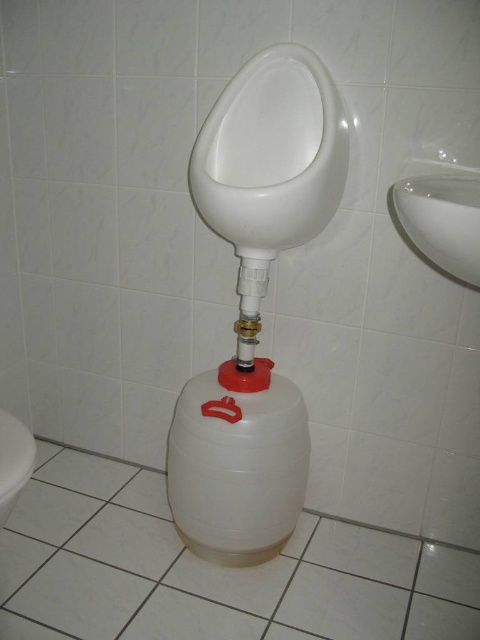
Question: Which object is the closest to the white plastic bidet at lower left?

Choices:
 (A) white glossy sink at upper right
 (B) white matte bidet at upper center
 (C) white plastic bidet at center

Answer: (C)

Question: Considering the relative positions of white matte bidet at upper center and white plastic bidet at center in the image provided, where is white matte bidet at upper center located with respect to white plastic bidet at center?

Choices:
 (A) right
 (B) left

Answer: (A)

Question: Which point appears closest to the camera in this image?

Choices:
 (A) (471, 243)
 (B) (230, 499)

Answer: (A)

Question: Can you confirm if white glossy sink at upper right is positioned to the left of white plastic bidet at lower left?

Choices:
 (A) no
 (B) yes

Answer: (A)

Question: Can you confirm if white plastic bidet at center is thinner than white glossy sink at upper right?

Choices:
 (A) no
 (B) yes

Answer: (A)

Question: Which of the following is the farthest from the observer?

Choices:
 (A) white matte bidet at upper center
 (B) white plastic bidet at lower left
 (C) white glossy sink at upper right

Answer: (A)